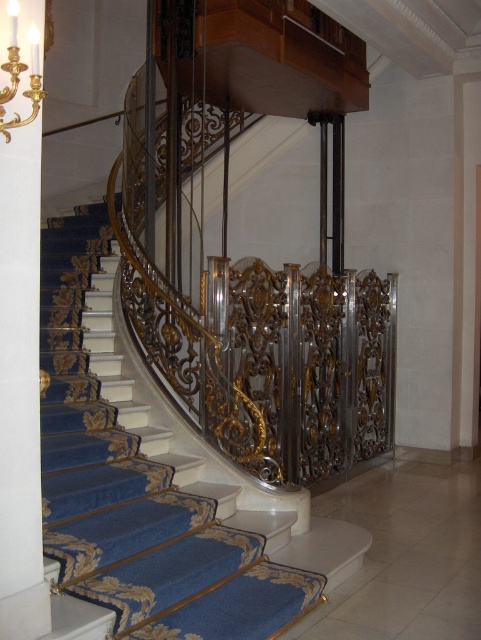
You are an interior designer planning to install a new lighting fixture. You have two options based on the objects in the scene. The first option is a large chandelier that requires a larger space, and the second is a smaller sconce. Given the sizes of the blue carpeted stairs at center and the white glossy pillar at left, which object would be more suitable for placing the large chandelier above?

The blue carpeted stairs at center is larger in size than the white glossy pillar at left, so the large chandelier would be more suitable to place above the blue carpeted stairs at center since it has enough space.

You are an interior designer planning to place a large sculpture between the white glossy pillar at left and the gold metallic chandelier at upper left. Which object should the sculpture be closer to if you want it to balance the visual weight based on their widths?

The sculpture should be closer to the gold metallic chandelier at upper left because the white glossy pillar at left is wider, so placing the sculpture closer to the narrower chandelier will balance the visual weight between the two objects.